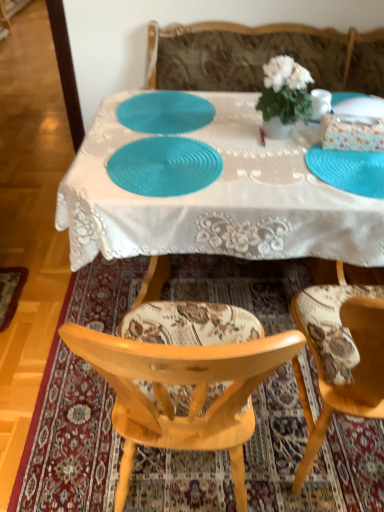
You are a GUI agent. You are given a task and a screenshot of the screen. Output one action in this format:
    pyautogui.click(x=<x>, y=<y>)
    Task: Click on the free space in front of white matte flower pot at center
    This screenshot has width=384, height=512.
    Given the screenshot: What is the action you would take?
    pyautogui.click(x=291, y=156)